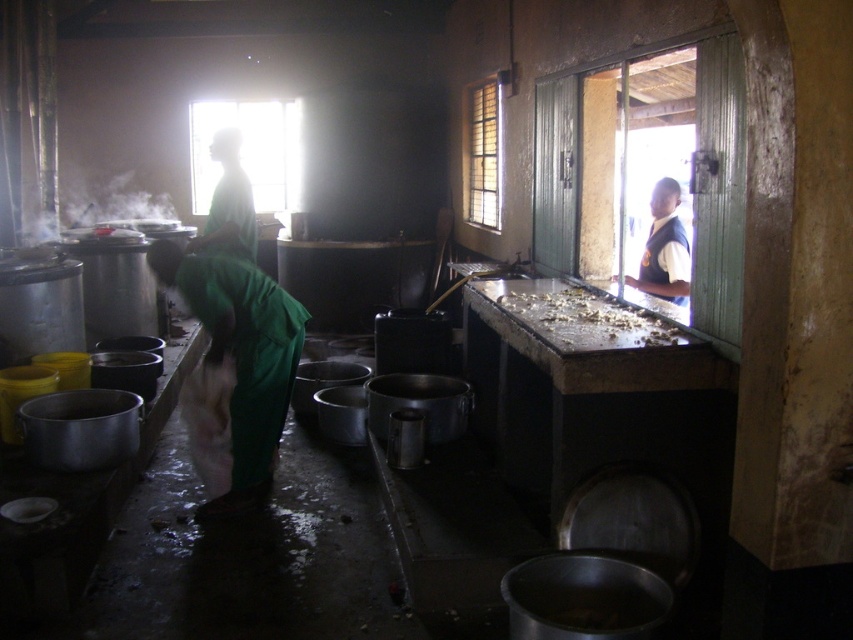
You are a worker in the kitchen and need to move a box from the floor to the counter. There is a green fabric at center and a white shirt at upper right in your way. Which object is wider so you need to avoid it when moving the box?

The green fabric at center is wider than the white shirt at upper right, so you need to avoid the green fabric at center when moving the box.